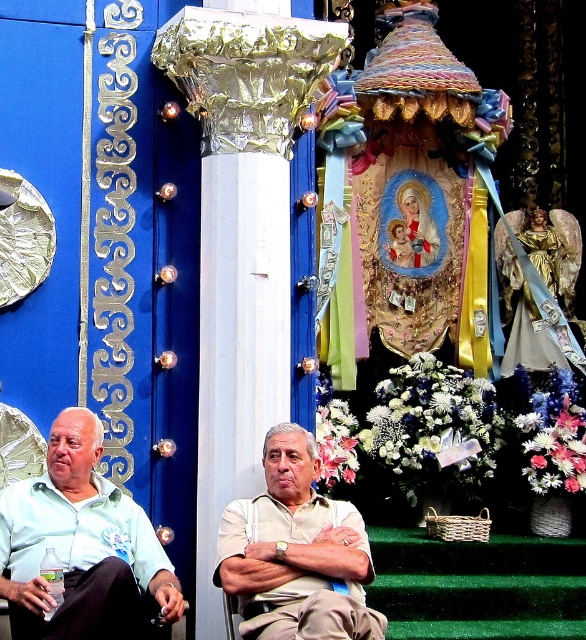
You are a photographer at this event and need to capture a clear shot of the light green fabric shirt at center. However, the silver foil column at center is blocking your view. Can you move the column to the side to get a better angle?

The light green fabric shirt at center is behind the silver foil column at center, so moving the column might reveal the shirt better, but since the column is part of the decoration, it might not be advisable to move it without permission.